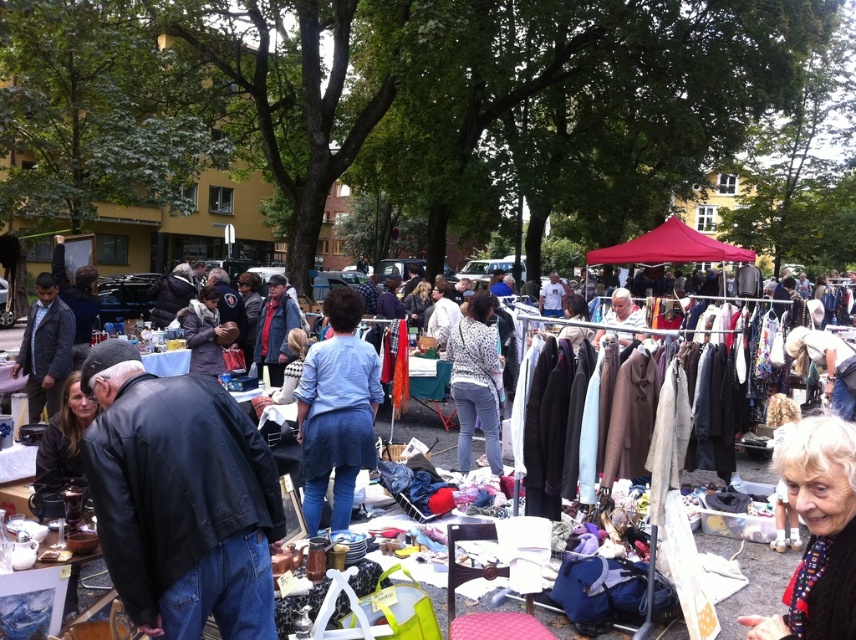
You are a customer at the flea market and want to buy a jacket or sweater. You have a small backpack that can only fit items narrower than the matte black jacket at center. Can the white woolen sweater at lower right fit in your backpack?

The white woolen sweater at lower right is narrower than the matte black jacket at center, so it can fit in your backpack.

You are a customer at the flea market and want to buy the white woolen sweater at lower right. Where exactly should you look to find it?

The white woolen sweater at lower right is located at point coordinates of (817, 532).

You are a customer at the flea market looking for a jacket that can fit over your winter coat. You see the black leather jacket at lower left and the textured fabric clothing at center. Which one is more likely to have enough space for layering?

The black leather jacket at lower left has a larger size compared to textured fabric clothing at center, so it is more likely to have enough space for layering over your winter coat.